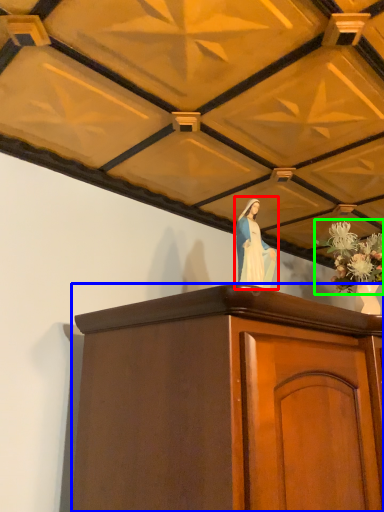
Question: Based on their relative distances, which object is nearer to woman (highlighted by a red box)? Choose from furniture (highlighted by a blue box) and floral arrangement (highlighted by a green box).

Choices:
 (A) furniture
 (B) floral arrangement

Answer: (A)